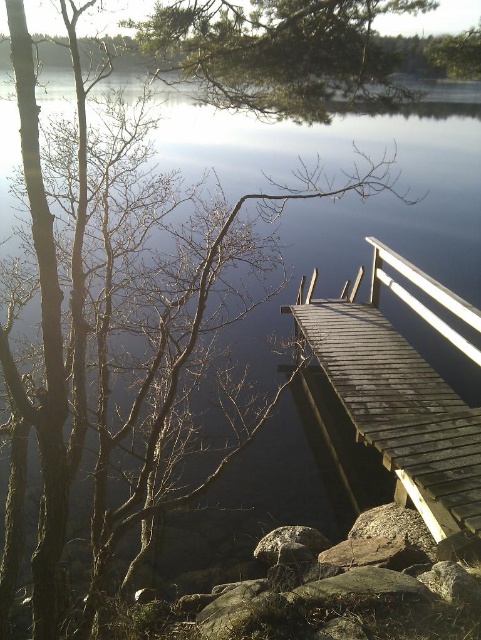
Does green textured pine branch at upper center have a larger size compared to white glossy rail at upper right?

No, green textured pine branch at upper center is not bigger than white glossy rail at upper right.

Measure the distance between green textured pine branch at upper center and camera.

2.86 meters

Identify the location of green textured pine branch at upper center. (278, 51).

Is point (455, 305) farther from viewer compared to point (470, 323)?

Yes.

Between point (367, 442) and point (459, 348), which one is positioned behind?

Positioned behind is point (459, 348).

Find the location of a particular element. dark brown wooden dock at right is located at coordinates (403, 394).

You are a GUI agent. You are given a task and a screenshot of the screen. Output one action in this format:
    pyautogui.click(x=<x>, y=<y>)
    Task: Click on the dark brown wooden dock at right
    Image resolution: width=481 pixels, height=640 pixels.
    Given the screenshot: What is the action you would take?
    pyautogui.click(x=403, y=394)

How much distance is there between dark brown wooden dock at right and green textured pine branch at upper center?

dark brown wooden dock at right is 8.61 feet from green textured pine branch at upper center.

Between point (374, 310) and point (176, 81), which one is positioned in front?

Point (374, 310) is more forward.

Locate an element on the screen. This screenshot has width=481, height=640. dark brown wooden dock at right is located at coordinates (403, 394).